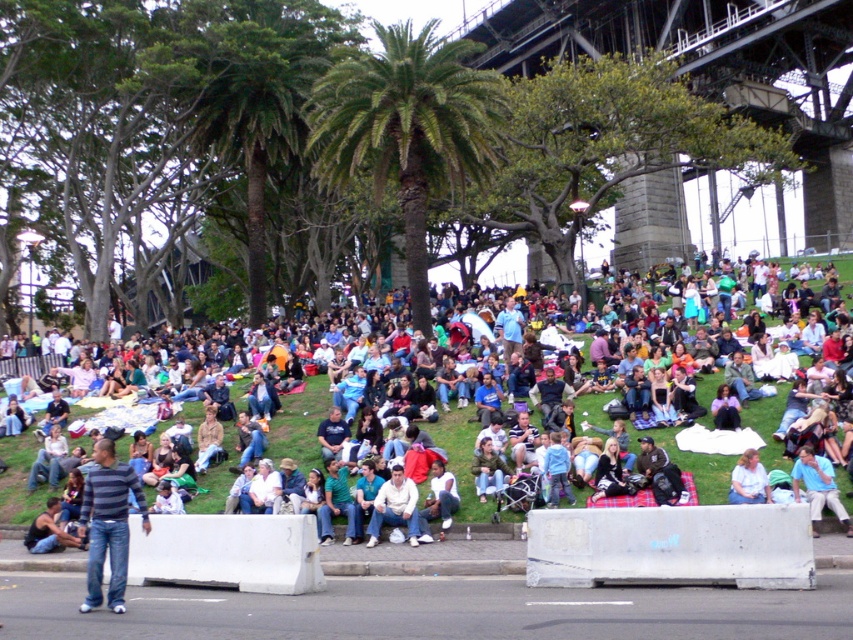
Question: Does striped shirt at lower left have a greater width compared to light beige shirt at center?

Choices:
 (A) yes
 (B) no

Answer: (A)

Question: Where is metallic steel bridge at upper center located in relation to light beige shirt at center in the image?

Choices:
 (A) left
 (B) right

Answer: (B)

Question: Estimate the real-world distances between objects in this image. Which object is closer to the light blue shirt at center?

Choices:
 (A) green leafy palm tree at center
 (B) light beige shirt at center

Answer: (B)

Question: Which point is closer to the camera?

Choices:
 (A) (228, 326)
 (B) (759, 88)

Answer: (A)

Question: Is green leafy palm tree at center smaller than light beige shirt at center?

Choices:
 (A) yes
 (B) no

Answer: (B)

Question: Which of the following is the closest to the observer?

Choices:
 (A) (393, 140)
 (B) (685, 179)

Answer: (A)